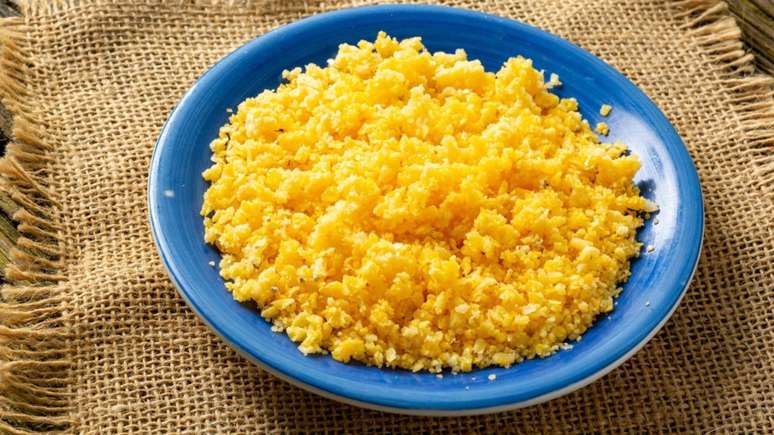
Where is `table`? The height and width of the screenshot is (435, 774). table is located at coordinates (759, 25), (12, 4), (7, 125), (9, 227).